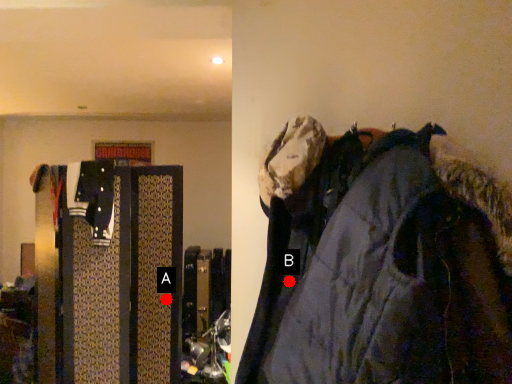
Question: Two points are circled on the image, labeled by A and B beside each circle. Which point is farther from the camera taking this photo?

Choices:
 (A) A is further
 (B) B is further

Answer: (A)